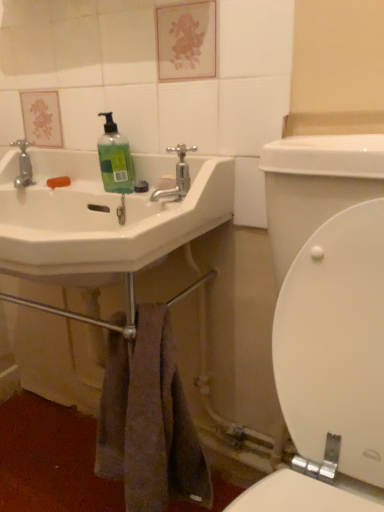
Question: Is the position of white glossy toilet at lower right more distant than that of brown textured towel at lower center?

Choices:
 (A) no
 (B) yes

Answer: (B)

Question: Is white glossy toilet at lower right at the right side of brown textured towel at lower center?

Choices:
 (A) yes
 (B) no

Answer: (A)

Question: Is white glossy toilet at lower right in front of brown textured towel at lower center?

Choices:
 (A) no
 (B) yes

Answer: (A)

Question: Is white glossy toilet at lower right outside brown textured towel at lower center?

Choices:
 (A) yes
 (B) no

Answer: (A)

Question: From a real-world perspective, is white glossy toilet at lower right beneath brown textured towel at lower center?

Choices:
 (A) no
 (B) yes

Answer: (B)

Question: Is brown textured towel at lower center a part of white glossy toilet at lower right?

Choices:
 (A) yes
 (B) no

Answer: (B)

Question: From the image's perspective, would you say white glossy sink at left is shown under polished chrome faucet at upper center?

Choices:
 (A) no
 (B) yes

Answer: (B)

Question: From the image's perspective, is white glossy sink at left located above polished chrome faucet at upper center?

Choices:
 (A) no
 (B) yes

Answer: (A)

Question: Is white glossy sink at left turned away from polished chrome faucet at upper center?

Choices:
 (A) yes
 (B) no

Answer: (A)

Question: Is white glossy sink at left smaller than polished chrome faucet at upper center?

Choices:
 (A) yes
 (B) no

Answer: (B)

Question: Is white glossy sink at left further to the viewer compared to polished chrome faucet at upper center?

Choices:
 (A) no
 (B) yes

Answer: (A)

Question: Can you confirm if white glossy sink at left is bigger than polished chrome faucet at upper center?

Choices:
 (A) no
 (B) yes

Answer: (B)

Question: From the image's perspective, is brown textured towel at lower center beneath green matte liquid soap at upper left?

Choices:
 (A) yes
 (B) no

Answer: (A)